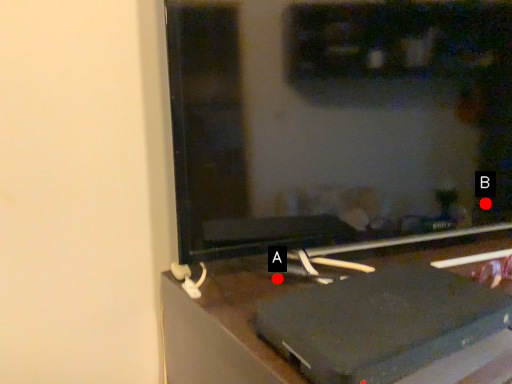
Question: Two points are circled on the image, labeled by A and B beside each circle. Which point is farther to the camera?

Choices:
 (A) A is further
 (B) B is further

Answer: (B)